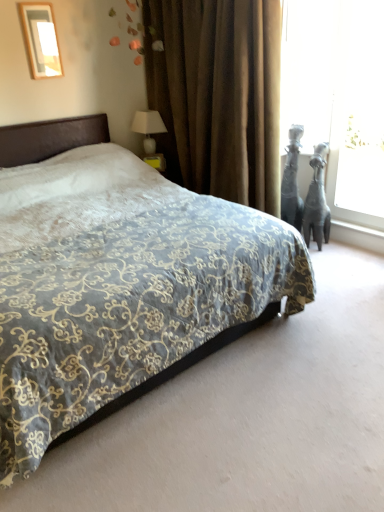
Question: From a real-world perspective, is white glossy table lamp at upper right below velvet-patterned bed at center?

Choices:
 (A) no
 (B) yes

Answer: (A)

Question: Can you confirm if white glossy table lamp at upper right is taller than velvet-patterned bed at center?

Choices:
 (A) no
 (B) yes

Answer: (A)

Question: Does white glossy table lamp at upper right contain velvet-patterned bed at center?

Choices:
 (A) no
 (B) yes

Answer: (A)

Question: Does white glossy table lamp at upper right have a smaller size compared to velvet-patterned bed at center?

Choices:
 (A) yes
 (B) no

Answer: (A)

Question: Can you confirm if white glossy table lamp at upper right is bigger than velvet-patterned bed at center?

Choices:
 (A) yes
 (B) no

Answer: (B)

Question: From a real-world perspective, is matte black giraffe at right above or below matte white picture frame at upper left?

Choices:
 (A) above
 (B) below

Answer: (B)

Question: Considering the positions of point (326, 144) and point (46, 52), is point (326, 144) closer or farther from the camera than point (46, 52)?

Choices:
 (A) closer
 (B) farther

Answer: (B)

Question: Is matte black giraffe at right wider or thinner than matte white picture frame at upper left?

Choices:
 (A) wide
 (B) thin

Answer: (A)

Question: Is matte black giraffe at right bigger or smaller than matte white picture frame at upper left?

Choices:
 (A) small
 (B) big

Answer: (B)

Question: From the image's perspective, relative to matte white picture frame at upper left, is velvet-patterned bed at center above or below?

Choices:
 (A) above
 (B) below

Answer: (B)

Question: Is point (21, 185) positioned closer to the camera than point (31, 53)?

Choices:
 (A) farther
 (B) closer

Answer: (B)

Question: Is velvet-patterned bed at center situated inside matte white picture frame at upper left or outside?

Choices:
 (A) outside
 (B) inside

Answer: (A)

Question: Is velvet-patterned bed at center to the left or to the right of matte white picture frame at upper left in the image?

Choices:
 (A) right
 (B) left

Answer: (A)

Question: In terms of height, does black glossy statue at right look taller or shorter compared to white glossy table lamp at upper right?

Choices:
 (A) tall
 (B) short

Answer: (A)

Question: In the image, is black glossy statue at right on the left side or the right side of white glossy table lamp at upper right?

Choices:
 (A) left
 (B) right

Answer: (B)